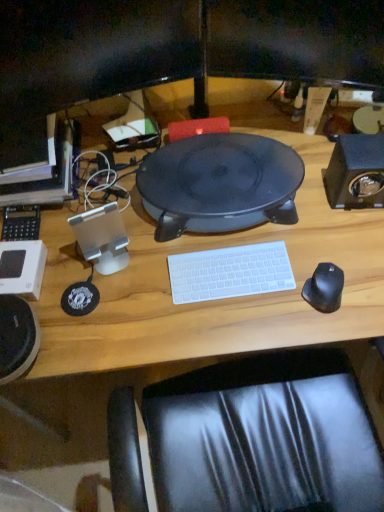
Locate an element on the screen. vacant space situated above black matte speaker at center (from a real-world perspective) is located at coordinates (212, 169).